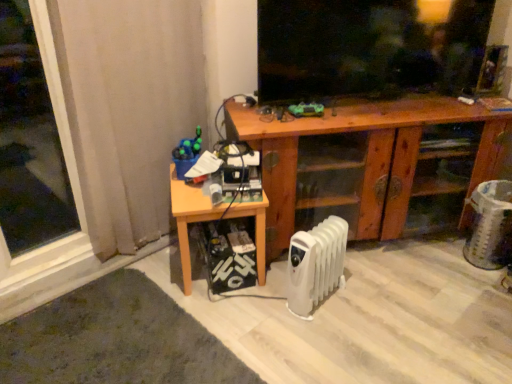
Question: Should I look upward or downward to see black matte screen at upper center?

Choices:
 (A) down
 (B) up

Answer: (B)

Question: From a real-world perspective, is white plastic radiator at lower center located beneath transparent glass window at left?

Choices:
 (A) no
 (B) yes

Answer: (B)

Question: Can you confirm if white plastic radiator at lower center is wider than transparent glass window at left?

Choices:
 (A) yes
 (B) no

Answer: (B)

Question: From the image's perspective, is white plastic radiator at lower center below transparent glass window at left?

Choices:
 (A) yes
 (B) no

Answer: (A)

Question: Is white plastic radiator at lower center positioned in front of transparent glass window at left?

Choices:
 (A) yes
 (B) no

Answer: (B)

Question: Is white plastic radiator at lower center not close to transparent glass window at left?

Choices:
 (A) yes
 (B) no

Answer: (A)

Question: From the image's perspective, does white plastic radiator at lower center appear higher than transparent glass window at left?

Choices:
 (A) no
 (B) yes

Answer: (A)

Question: Are wooden cabinet at center and wooden table at lower left beside each other?

Choices:
 (A) no
 (B) yes

Answer: (A)

Question: Is wooden cabinet at center wider than wooden table at lower left?

Choices:
 (A) yes
 (B) no

Answer: (A)

Question: Is wooden cabinet at center far away from wooden table at lower left?

Choices:
 (A) no
 (B) yes

Answer: (A)

Question: From a real-world perspective, is wooden cabinet at center over wooden table at lower left?

Choices:
 (A) no
 (B) yes

Answer: (B)

Question: Is wooden cabinet at center facing away from wooden table at lower left?

Choices:
 (A) yes
 (B) no

Answer: (B)

Question: Considering the relative sizes of wooden cabinet at center and wooden table at lower left in the image provided, is wooden cabinet at center thinner than wooden table at lower left?

Choices:
 (A) no
 (B) yes

Answer: (A)

Question: From the image's perspective, is wooden cabinet at center under white plastic radiator at lower center?

Choices:
 (A) no
 (B) yes

Answer: (A)